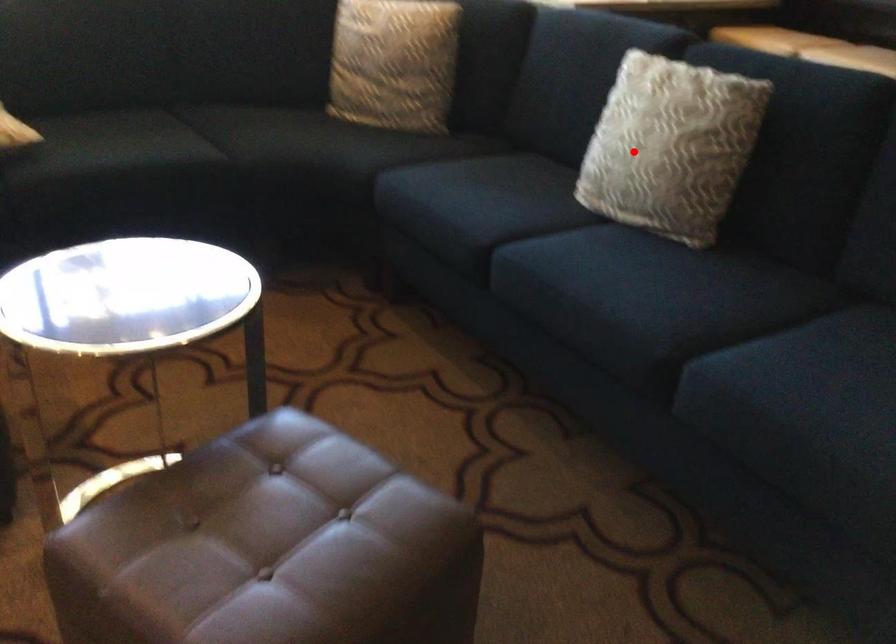
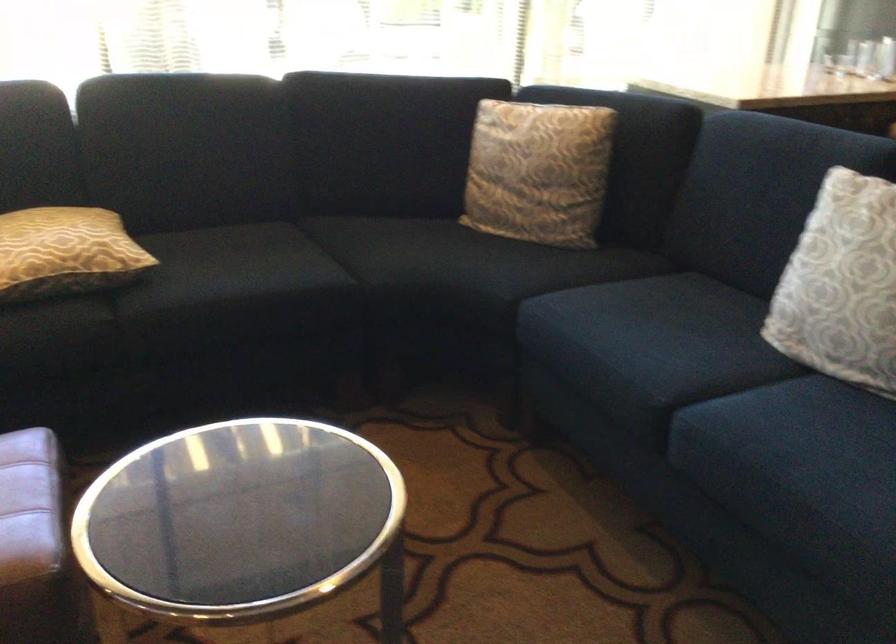
Question: I am providing you with two images of the same scene from different viewpoints. A red point is shown in image1. For the corresponding object point in image2, is it positioned nearer or farther from the camera?

Choices:
 (A) Nearer
 (B) Farther

Answer: (A)